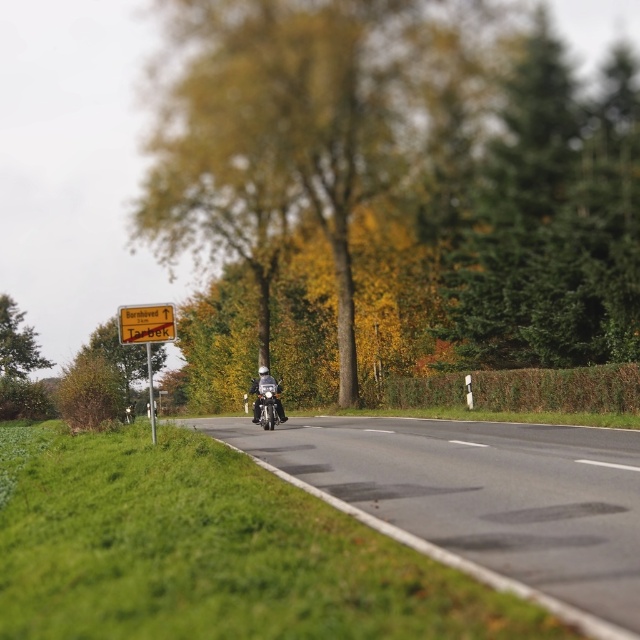
Does wooden textured sign at upper left appear on the left side of shiny black motorcycle at center?

Yes, wooden textured sign at upper left is to the left of shiny black motorcycle at center.

Which is above, wooden textured sign at upper left or shiny black motorcycle at center?

wooden textured sign at upper left is above.

Where is `wooden textured sign at upper left`? The width and height of the screenshot is (640, 640). wooden textured sign at upper left is located at coordinates (x=145, y=323).

The width and height of the screenshot is (640, 640). Find the location of `wooden textured sign at upper left`. wooden textured sign at upper left is located at coordinates (145, 323).

Can you confirm if green leafy tree at center is positioned above wooden textured sign at upper left?

Yes.

Is green leafy tree at center further to camera compared to wooden textured sign at upper left?

Yes, green leafy tree at center is further from the viewer.

Locate an element on the screen. The height and width of the screenshot is (640, 640). green leafy tree at center is located at coordinates (392, 193).

Who is positioned more to the right, green leafy tree at center or green leafy tree at left?

green leafy tree at center is more to the right.

Looking at this image, is green leafy tree at center shorter than green leafy tree at left?

No, green leafy tree at center is not shorter than green leafy tree at left.

Identify the location of green leafy tree at center. The width and height of the screenshot is (640, 640). (392, 193).